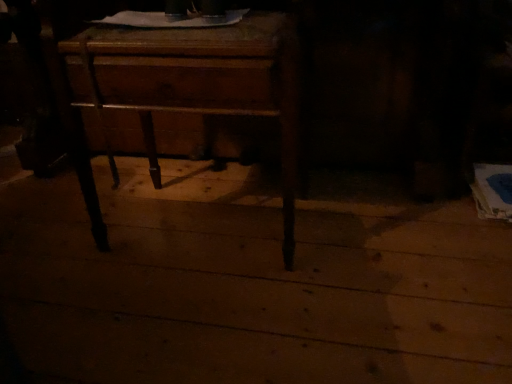
What is the approximate height of wooden drawer at center?

wooden drawer at center is 22.75 inches tall.

Describe the element at coordinates (195, 81) in the screenshot. I see `wooden drawer at center` at that location.

Locate an element on the screen. wooden drawer at center is located at coordinates (195, 81).

Where is `wooden drawer at center`? The width and height of the screenshot is (512, 384). wooden drawer at center is located at coordinates (195, 81).